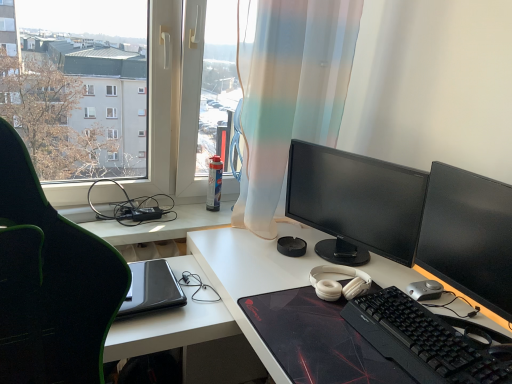
Where is `free spot to the left of silver metallic mouse at lower right`? The image size is (512, 384). free spot to the left of silver metallic mouse at lower right is located at coordinates (374, 277).